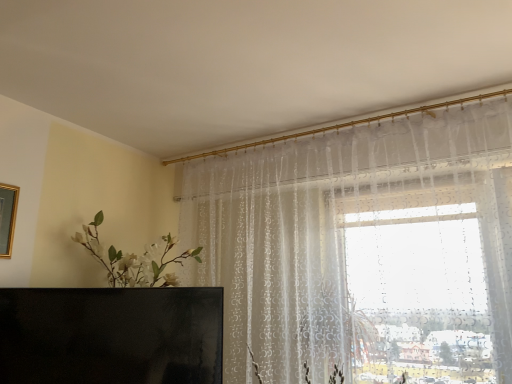
Question: Is gold-framed mirror at upper left wider or thinner than black glossy tv at lower left?

Choices:
 (A) thin
 (B) wide

Answer: (A)

Question: In terms of height, does gold-framed mirror at upper left look taller or shorter compared to black glossy tv at lower left?

Choices:
 (A) short
 (B) tall

Answer: (A)

Question: Is gold-framed mirror at upper left to the left or to the right of black glossy tv at lower left in the image?

Choices:
 (A) right
 (B) left

Answer: (B)

Question: Visually, is black glossy tv at lower left positioned to the left or to the right of gold-framed mirror at upper left?

Choices:
 (A) right
 (B) left

Answer: (A)

Question: Is black glossy tv at lower left situated inside gold-framed mirror at upper left or outside?

Choices:
 (A) inside
 (B) outside

Answer: (B)

Question: Looking at their shapes, would you say black glossy tv at lower left is wider or thinner than gold-framed mirror at upper left?

Choices:
 (A) thin
 (B) wide

Answer: (B)

Question: Considering the positions of point (177, 342) and point (1, 183), is point (177, 342) closer or farther from the camera than point (1, 183)?

Choices:
 (A) closer
 (B) farther

Answer: (B)